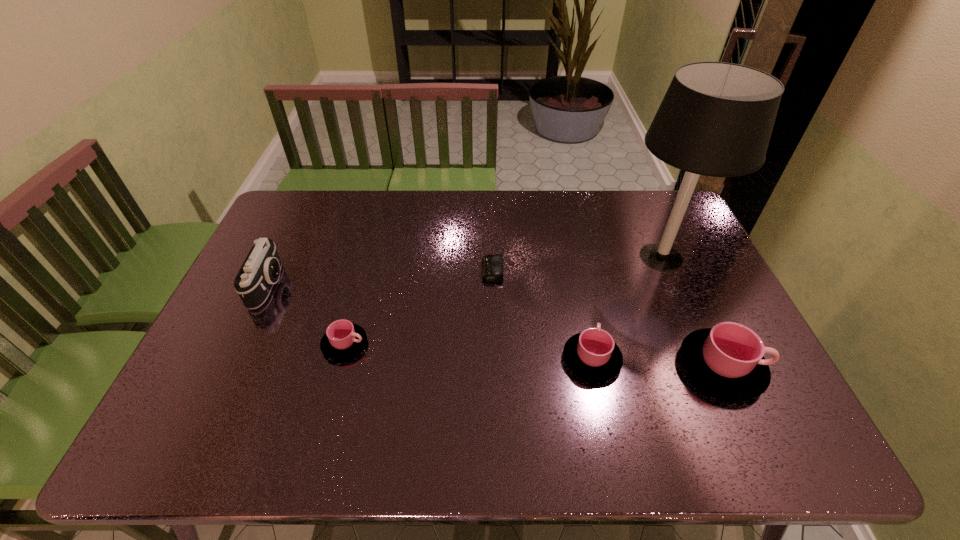
The width and height of the screenshot is (960, 540). Identify the location of vacant spot for a new cup to ensure equal spacing. (467, 352).